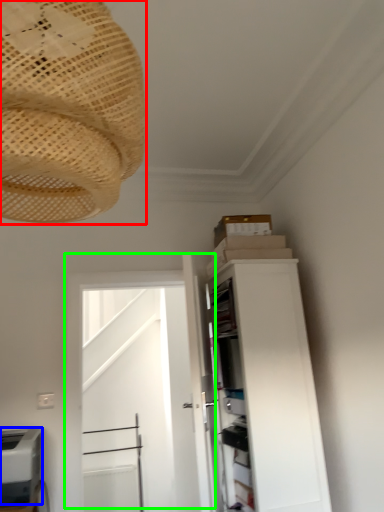
Question: Which is farther away from lamp (highlighted by a red box)? appliance (highlighted by a blue box) or door (highlighted by a green box)?

Choices:
 (A) appliance
 (B) door

Answer: (B)